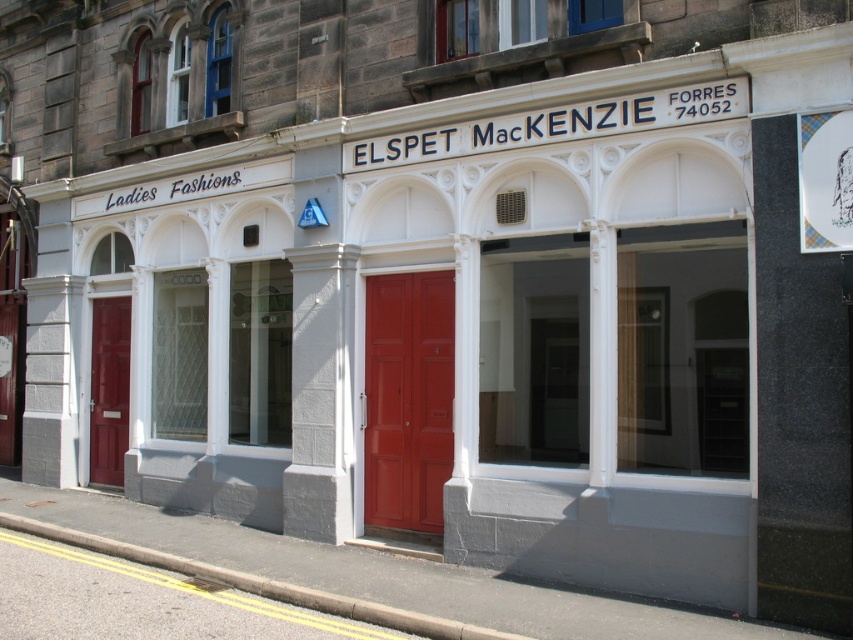
You are a delivery person with a cart that is 3 meters wide. You need to move your cart through the space between the two matte red doors. Can your cart fit through the space between the matte red door at center and the matte red door at left?

The distance between the matte red door at center and the matte red door at left is 4.35 meters. Since your cart is 3 meters wide, it can fit through the space between them.

What is the significance of the point located at coordinates (408, 397) in relation to the doors shown in the image?

The point at coordinates (408, 397) is located on the matte red door at center, indicating its position relative to the other door.